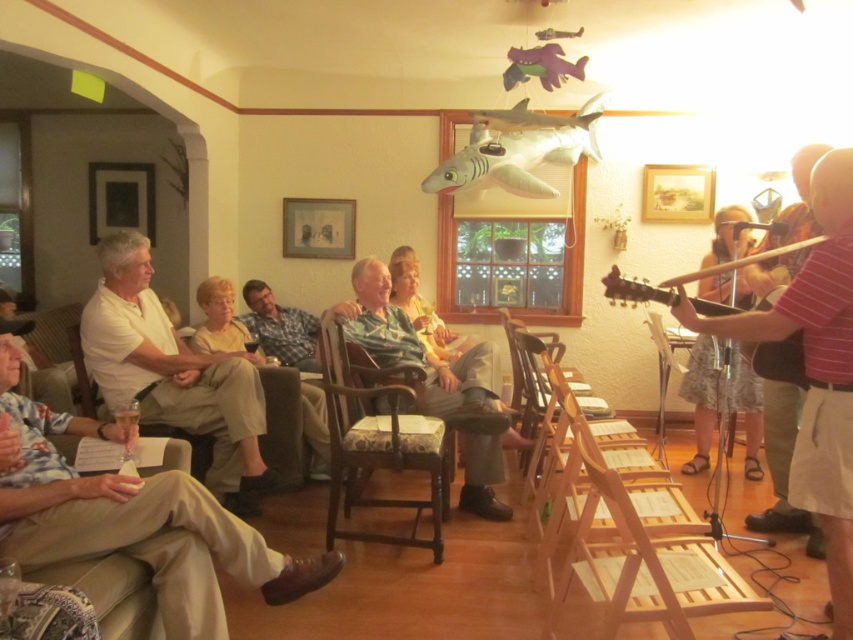
Between fabric upholstered chair at center and wooden armchair at lower left, which one has less height?

wooden armchair at lower left is shorter.

Between fabric upholstered chair at center and wooden armchair at lower left, which one appears on the right side from the viewer's perspective?

fabric upholstered chair at center is more to the right.

Which is in front, point (419, 436) or point (189, 440)?

Positioned in front is point (419, 436).

Locate an element on the screen. fabric upholstered chair at center is located at coordinates (376, 442).

Is brown wooden guitar at right positioned at the back of matte silver picture frame at center?

No, brown wooden guitar at right is in front of matte silver picture frame at center.

In the scene shown: Can you confirm if brown wooden guitar at right is taller than matte silver picture frame at center?

In fact, brown wooden guitar at right may be shorter than matte silver picture frame at center.

Between point (747, 355) and point (315, 241), which one is positioned in front?

Positioned in front is point (747, 355).

Find the location of a particular element. Image resolution: width=853 pixels, height=640 pixels. brown wooden guitar at right is located at coordinates (779, 360).

Who is lower down, white cotton shirt at left or matte silver picture frame at center?

Positioned lower is white cotton shirt at left.

At what (x,y) coordinates should I click in order to perform the action: click on white cotton shirt at left. Please return your answer as a coordinate pair (x, y). This screenshot has width=853, height=640. Looking at the image, I should click on (173, 372).

Identify the location of white cotton shirt at left. The height and width of the screenshot is (640, 853). 173,372.